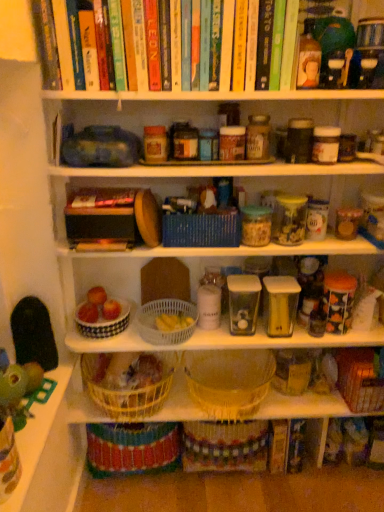
Question: Is blue woven basket at center, positioned as the fourth basket in left-to-right order, positioned in front of woven straw basket at center, which is the second basket from right to left?

Choices:
 (A) no
 (B) yes

Answer: (B)

Question: Is blue woven basket at center, positioned as the fourth basket in left-to-right order, positioned far away from woven straw basket at center, which is the second basket from right to left?

Choices:
 (A) yes
 (B) no

Answer: (B)

Question: From a real-world perspective, is blue woven basket at center, positioned as the fourth basket in left-to-right order, positioned over woven straw basket at center, marked as the 5th basket in a left-to-right arrangement, based on gravity?

Choices:
 (A) no
 (B) yes

Answer: (B)

Question: From the image's perspective, would you say blue woven basket at center, positioned as the fourth basket in left-to-right order, is shown under woven straw basket at center, marked as the 5th basket in a left-to-right arrangement?

Choices:
 (A) no
 (B) yes

Answer: (A)

Question: Can you confirm if blue woven basket at center, arranged as the third basket when viewed from the right, is thinner than woven straw basket at center, which is the second basket from right to left?

Choices:
 (A) no
 (B) yes

Answer: (B)

Question: Does blue woven basket at center, arranged as the third basket when viewed from the right, have a smaller size compared to woven straw basket at center, marked as the 5th basket in a left-to-right arrangement?

Choices:
 (A) no
 (B) yes

Answer: (B)

Question: Could you tell me if black rubber toy at left, which is the 1th toy in back-to-front order, is turned towards transparent plastic container at center-right, which ranks as the 1th glass jar in right-to-left order?

Choices:
 (A) yes
 (B) no

Answer: (A)

Question: Is black rubber toy at left, positioned as the second toy in front-to-back order, far away from transparent plastic container at center-right, which ranks as the second glass jar in left-to-right order?

Choices:
 (A) yes
 (B) no

Answer: (B)

Question: Is black rubber toy at left, which is the 1th toy in back-to-front order, looking in the opposite direction of transparent plastic container at center-right, which ranks as the 1th glass jar in right-to-left order?

Choices:
 (A) yes
 (B) no

Answer: (B)

Question: From the image's perspective, is black rubber toy at left, which is the 1th toy in back-to-front order, under transparent plastic container at center-right, which ranks as the 1th glass jar in right-to-left order?

Choices:
 (A) yes
 (B) no

Answer: (A)

Question: Is the surface of black rubber toy at left, positioned as the second toy in front-to-back order, in direct contact with transparent plastic container at center-right, which ranks as the 1th glass jar in right-to-left order?

Choices:
 (A) yes
 (B) no

Answer: (B)

Question: Does black rubber toy at left, positioned as the second toy in front-to-back order, have a smaller size compared to transparent plastic container at center-right, which ranks as the second glass jar in left-to-right order?

Choices:
 (A) no
 (B) yes

Answer: (A)

Question: Considering the relative sizes of white ceramic bowl at center, which is the 1th basket from left to right, and woven straw basket at center, marked as the 5th basket in a left-to-right arrangement, in the image provided, is white ceramic bowl at center, which is the 1th basket from left to right, bigger than woven straw basket at center, marked as the 5th basket in a left-to-right arrangement,?

Choices:
 (A) no
 (B) yes

Answer: (A)